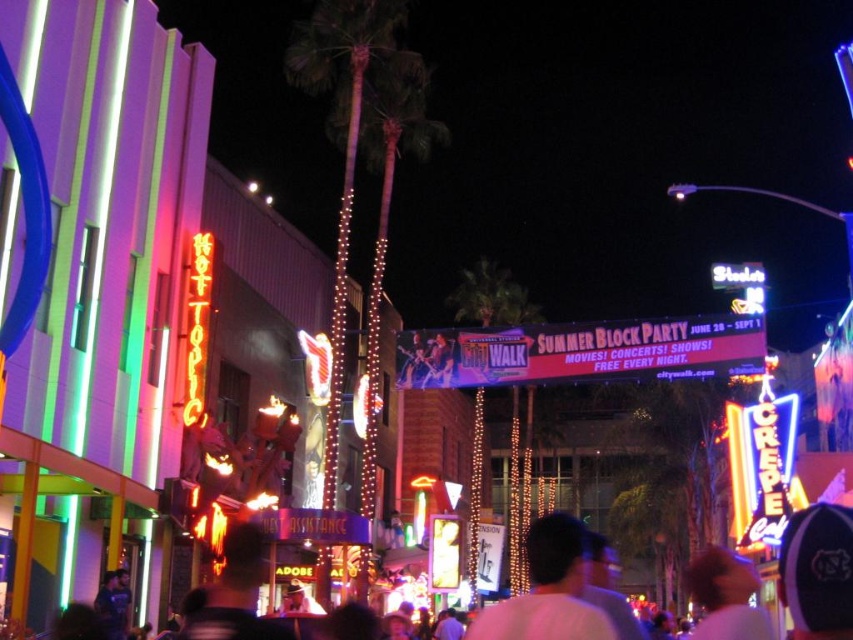
Question: Among these objects, which one is nearest to the camera?

Choices:
 (A) blurred hair at center
 (B) white matte shirt at center
 (C) white cotton crowd at center

Answer: (B)

Question: In this image, where is white matte shirt at center located relative to blurred hair at center?

Choices:
 (A) right
 (B) left

Answer: (B)

Question: From the image, what is the correct spatial relationship of white cotton crowd at center in relation to blurred hair at center?

Choices:
 (A) left
 (B) right

Answer: (A)

Question: Which object is the farthest from the blurred hair at center?

Choices:
 (A) white matte shirt at center
 (B) white cotton crowd at center

Answer: (A)

Question: Is white matte shirt at center above blurred hair at center?

Choices:
 (A) no
 (B) yes

Answer: (B)

Question: Which object appears farthest from the camera in this image?

Choices:
 (A) blurred hair at center
 (B) white matte shirt at center

Answer: (A)